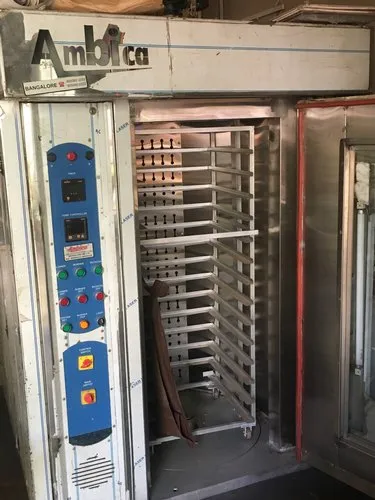
Find the location of `red knobs`. red knobs is located at coordinates (89, 359), (87, 398).